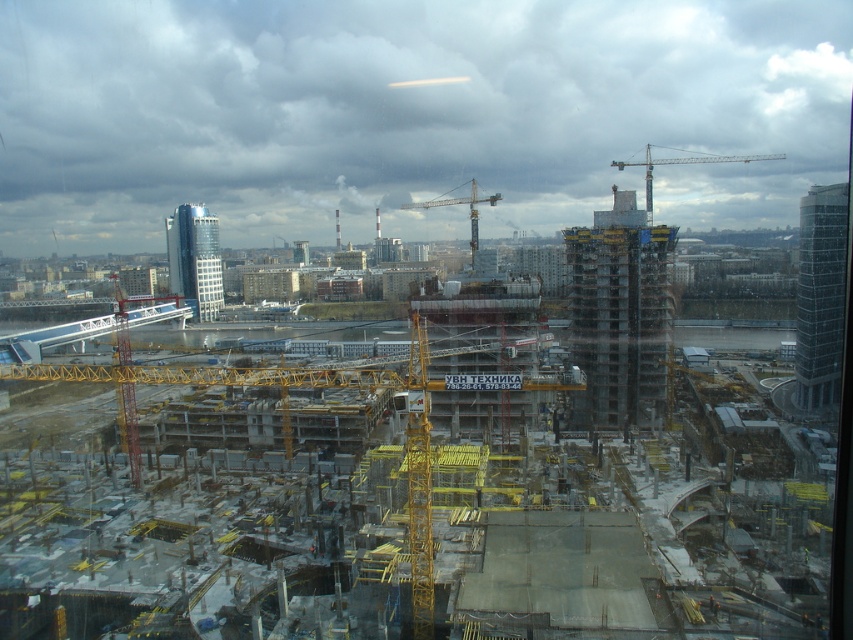
Is concrete at center smaller than yellow metallic crane at upper center?

Correct, concrete at center occupies less space than yellow metallic crane at upper center.

Which is above, concrete at center or yellow metallic crane at upper center?

yellow metallic crane at upper center is higher up.

In order to click on concrete at center in this screenshot , I will do `click(442, 470)`.

Does concrete at center appear on the right side of yellow metallic crane at center?

No, concrete at center is not to the right of yellow metallic crane at center.

Which is below, concrete at center or yellow metallic crane at center?

concrete at center

Is point (120, 572) positioned behind point (434, 198)?

That is False.

Where is `concrete at center`? Image resolution: width=853 pixels, height=640 pixels. concrete at center is located at coordinates (442, 470).

Can you confirm if yellow metallic crane at upper center is positioned above yellow metallic crane at center?

Yes, yellow metallic crane at upper center is above yellow metallic crane at center.

The image size is (853, 640). I want to click on yellow metallic crane at upper center, so click(x=683, y=163).